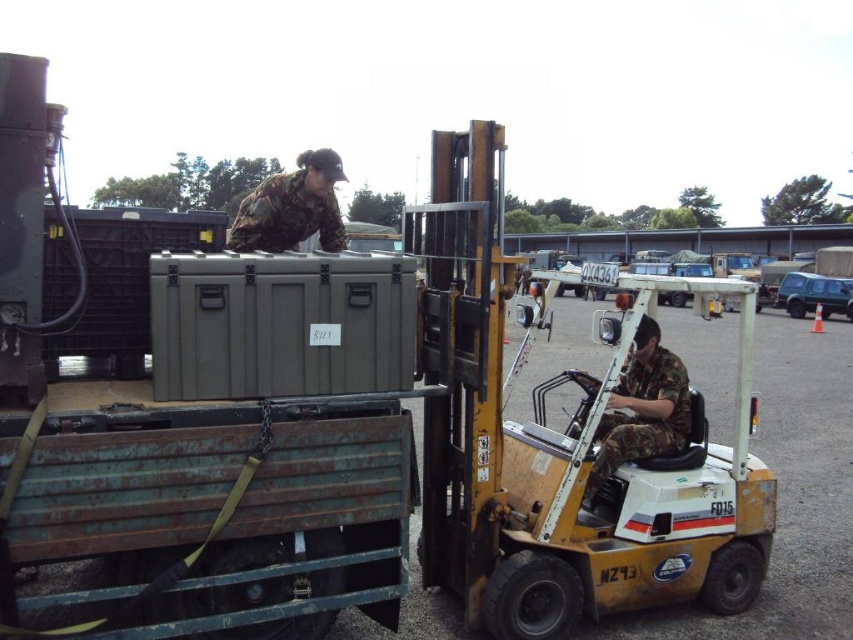
Question: From the image, what is the correct spatial relationship of camouflage fabric uniform at center in relation to camouflage fabric uniform at upper center?

Choices:
 (A) above
 (B) below

Answer: (B)

Question: Is camouflage fabric uniform at center closer to the viewer compared to camouflage fabric uniform at upper center?

Choices:
 (A) yes
 (B) no

Answer: (A)

Question: Is camouflage fabric uniform at center above camouflage fabric uniform at upper center?

Choices:
 (A) yes
 (B) no

Answer: (B)